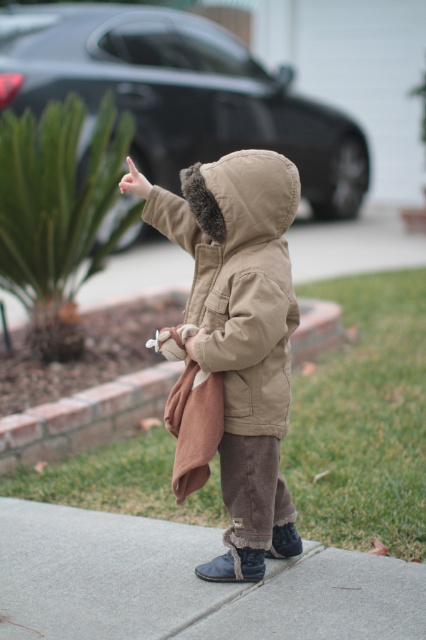
Can you confirm if gray concrete sidewalk at lower center is bigger than brown fabric at center?

Actually, gray concrete sidewalk at lower center might be smaller than brown fabric at center.

Who is positioned more to the right, gray concrete sidewalk at lower center or brown fabric at center?

Positioned to the right is gray concrete sidewalk at lower center.

Which is behind, point (339, 632) or point (304, 330)?

Point (304, 330)

The width and height of the screenshot is (426, 640). Identify the location of gray concrete sidewalk at lower center. (189, 582).

Is shiny black car at upper center to the right of brown fabric at center from the viewer's perspective?

Indeed, shiny black car at upper center is positioned on the right side of brown fabric at center.

Who is more forward, (132, 92) or (25, 464)?

Point (25, 464)

Image resolution: width=426 pixels, height=640 pixels. What do you see at coordinates (181, 93) in the screenshot?
I see `shiny black car at upper center` at bounding box center [181, 93].

At what (x,y) coordinates should I click in order to perform the action: click on shiny black car at upper center. Please return your answer as a coordinate pair (x, y). Looking at the image, I should click on [x=181, y=93].

At what (x,y) coordinates should I click in order to perform the action: click on gray concrete sidewalk at lower center. Please return your answer as a coordinate pair (x, y). Looking at the image, I should click on (189, 582).

Can you confirm if gray concrete sidewalk at lower center is shorter than light skin tone flesh at upper center?

Yes, gray concrete sidewalk at lower center is shorter than light skin tone flesh at upper center.

In order to click on gray concrete sidewalk at lower center in this screenshot , I will do `click(189, 582)`.